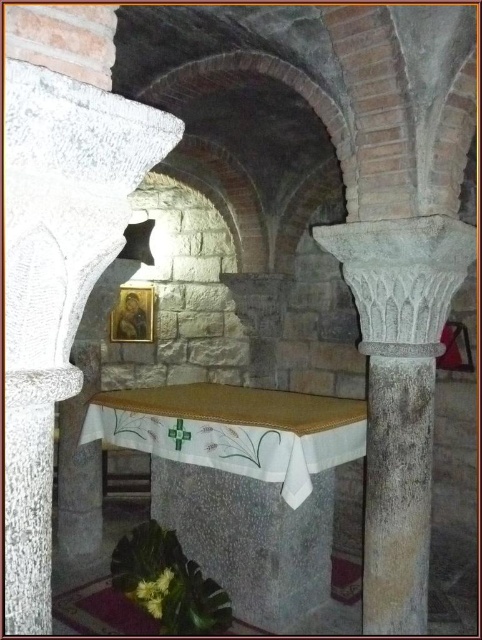
Between granite column at left and gray stone column at center, which one is positioned lower?

Positioned lower is gray stone column at center.

Is granite column at left bigger than gray stone column at center?

No.

This screenshot has height=640, width=482. Identify the location of granite column at left. (56, 250).